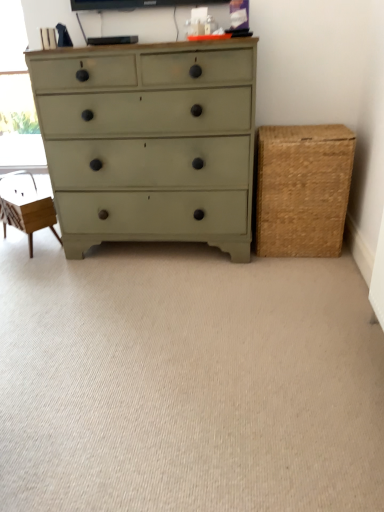
Locate an element on the screen. Image resolution: width=384 pixels, height=512 pixels. free region under wooden swivel chair at left (from a real-world perspective) is located at coordinates (38, 241).